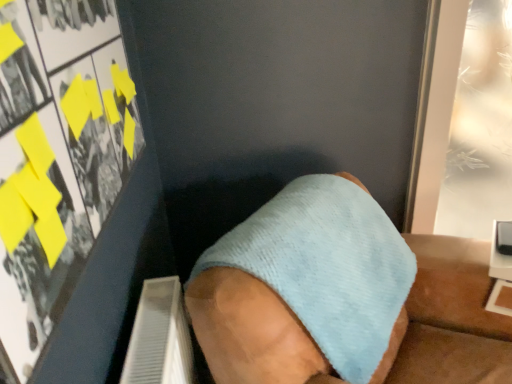
Question: From their relative heights in the image, would you say matte paper poster at upper left, the 2th poster page when ordered from back to front, is taller or shorter than light blue fabric sock at center?

Choices:
 (A) short
 (B) tall

Answer: (B)

Question: Considering their positions, is matte paper poster at upper left, arranged as the 1th poster page when viewed from the front, located in front of or behind light blue fabric sock at center?

Choices:
 (A) front
 (B) behind

Answer: (A)

Question: Estimate the real-world distances between objects in this image. Which object is farther from the transparent glass door at upper right, the first poster page positioned from the right?

Choices:
 (A) matte paper poster at upper left, the first poster page positioned from the left
 (B) light blue fabric sock at center

Answer: (A)

Question: Which of these objects is positioned closest to the light blue fabric sock at center?

Choices:
 (A) matte paper poster at upper left, the first poster page positioned from the left
 (B) transparent glass door at upper right, the 2th poster page when ordered from left to right

Answer: (A)